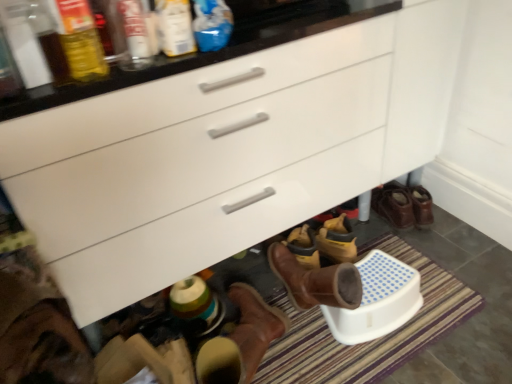
The width and height of the screenshot is (512, 384). Find the location of `free space in front of brown leather boots at lower right`. free space in front of brown leather boots at lower right is located at coordinates (439, 242).